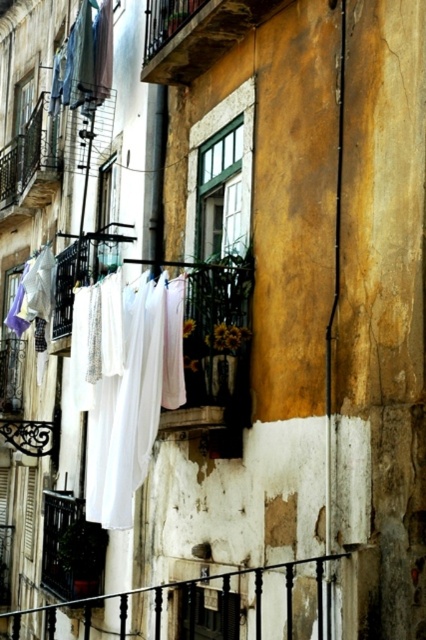
Question: Based on their relative distances, which object is nearer to the white fabric at center?

Choices:
 (A) black metal railing at lower center
 (B) white cotton shirt at upper left

Answer: (A)

Question: Does black metal railing at lower center appear on the left side of white cotton shirt at upper left?

Choices:
 (A) no
 (B) yes

Answer: (B)

Question: Which is farther from the white fabric at center?

Choices:
 (A) white cotton shirt at upper left
 (B) black metal railing at lower center

Answer: (A)

Question: Does white fabric at center appear on the left side of black metal railing at lower center?

Choices:
 (A) no
 (B) yes

Answer: (A)

Question: Which point is farther to the camera?

Choices:
 (A) white fabric at center
 (B) black metal railing at lower center

Answer: (A)

Question: Where is black metal railing at lower center located in relation to white cotton shirt at upper left in the image?

Choices:
 (A) left
 (B) right

Answer: (A)